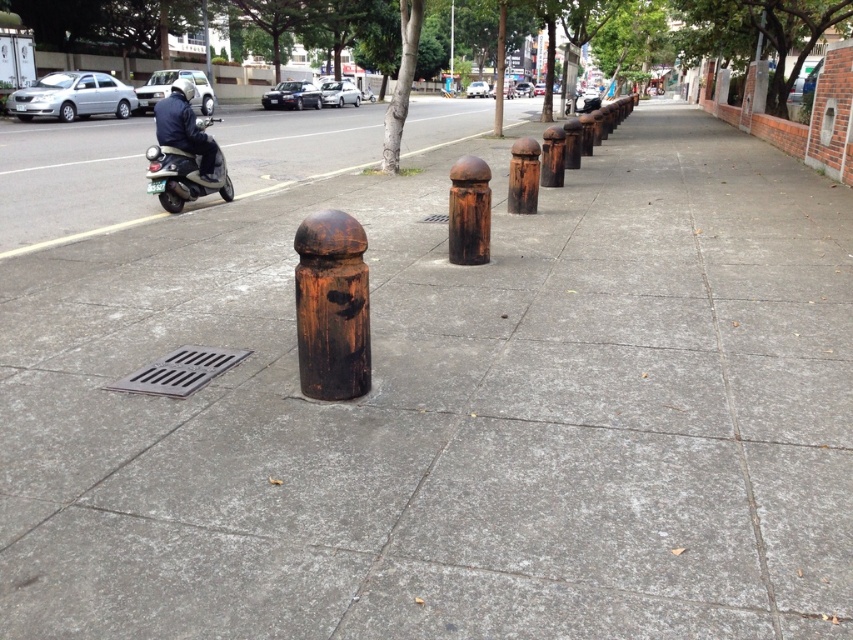
Question: Considering the real-world distances, which object is closest to the rusty wood post at center?

Choices:
 (A) matte black scooter at left
 (B) rusty metal post at center
 (C) rusty metal bollard at center

Answer: (C)

Question: Is matte black scooter at left to the left of rusty metal post at center from the viewer's perspective?

Choices:
 (A) yes
 (B) no

Answer: (A)

Question: From the image, what is the correct spatial relationship of matte black scooter at left in relation to rusty metal bollard at center?

Choices:
 (A) below
 (B) above

Answer: (B)

Question: Considering the real-world distances, which object is farthest from the rusty metal post at center?

Choices:
 (A) rusty wood post at center
 (B) rusty metal bollard at center
 (C) matte black scooter at left

Answer: (C)

Question: Considering the real-world distances, which object is farthest from the rusty metal post at center?

Choices:
 (A) rusty wood post at center
 (B) matte black scooter at left

Answer: (B)

Question: Observing the image, what is the correct spatial positioning of rusty wood post at center in reference to rusty metal post at center?

Choices:
 (A) above
 (B) below

Answer: (B)